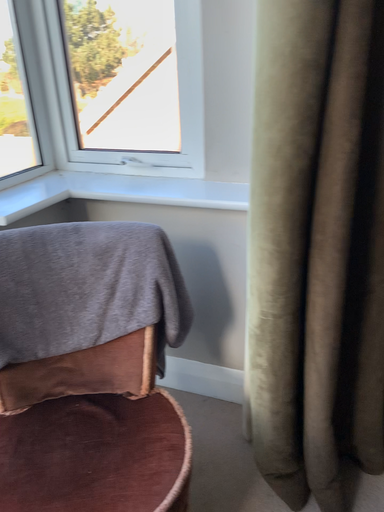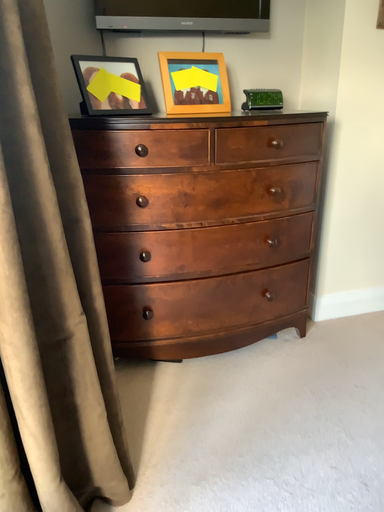
Question: Which way did the camera rotate in the video?

Choices:
 (A) rotated right
 (B) rotated left

Answer: (A)